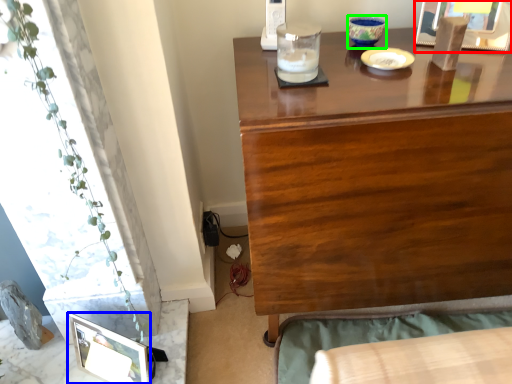
Question: Which object is the farthest from picture frame (highlighted by a red box)? Choose among these: picture frame (highlighted by a blue box) or candle holder (highlighted by a green box).

Choices:
 (A) picture frame
 (B) candle holder

Answer: (A)